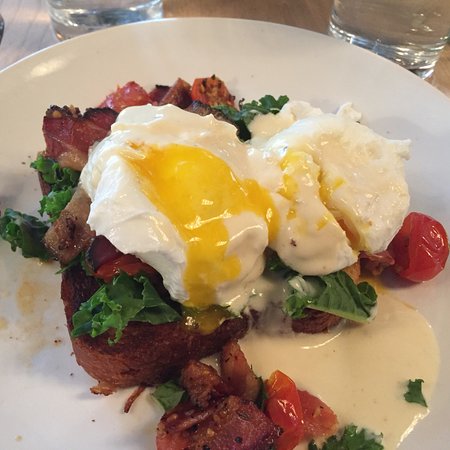
Identify the location of table. pos(440,81).